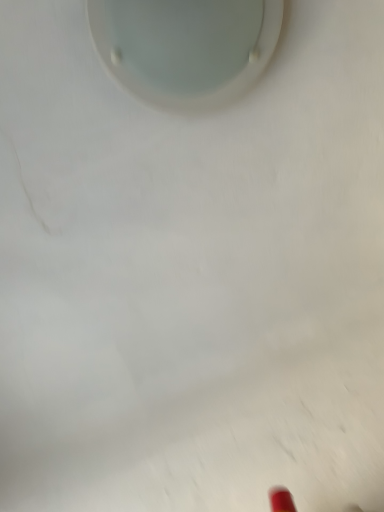
Describe the element at coordinates (186, 47) in the screenshot. This screenshot has height=512, width=384. I see `white glossy toilet at upper center` at that location.

Image resolution: width=384 pixels, height=512 pixels. I want to click on white glossy toilet at upper center, so click(186, 47).

I want to click on white glossy toilet at upper center, so click(x=186, y=47).